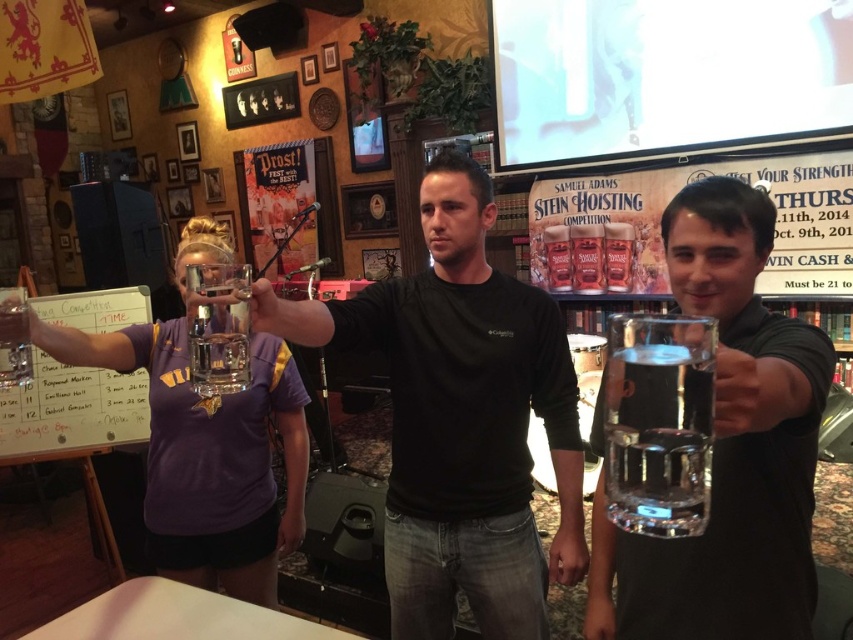
Between clear glass mug at center and clear glass beer at center, which one has less height?

With less height is clear glass beer at center.

Image resolution: width=853 pixels, height=640 pixels. I want to click on clear glass mug at center, so click(728, 449).

You are a GUI agent. You are given a task and a screenshot of the screen. Output one action in this format:
    pyautogui.click(x=<x>, y=<y>)
    Task: Click on the clear glass mug at center
    The height and width of the screenshot is (640, 853).
    Given the screenshot: What is the action you would take?
    pyautogui.click(x=728, y=449)

Does black matte shirt at center have a lesser height compared to clear glass beer at center?

No, black matte shirt at center is not shorter than clear glass beer at center.

Which of these two, black matte shirt at center or clear glass beer at center, stands shorter?

clear glass beer at center

This screenshot has width=853, height=640. Find the location of `black matte shirt at center`. black matte shirt at center is located at coordinates point(461,419).

Where is `black matte shirt at center`? This screenshot has height=640, width=853. black matte shirt at center is located at coordinates (461, 419).

From the picture: Can you confirm if white dry erase board at left is taller than clear glass at center?

Yes.

Who is shorter, white dry erase board at left or clear glass at center?

With less height is clear glass at center.

Which is in front, point (38, 436) or point (222, 346)?

Positioned in front is point (222, 346).

Find the location of `white dry erase board at left`. white dry erase board at left is located at coordinates (73, 408).